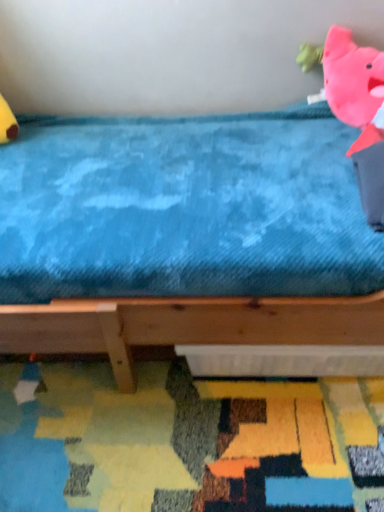
Question: Does textured multicolored mat at lower center have a lesser width compared to pink plush toy at upper right?

Choices:
 (A) no
 (B) yes

Answer: (A)

Question: Considering the relative sizes of textured multicolored mat at lower center and pink plush toy at upper right in the image provided, is textured multicolored mat at lower center bigger than pink plush toy at upper right?

Choices:
 (A) no
 (B) yes

Answer: (B)

Question: Does textured multicolored mat at lower center appear on the left side of pink plush toy at upper right?

Choices:
 (A) yes
 (B) no

Answer: (A)

Question: Can we say textured multicolored mat at lower center lies outside pink plush toy at upper right?

Choices:
 (A) no
 (B) yes

Answer: (B)

Question: Is textured multicolored mat at lower center positioned before pink plush toy at upper right?

Choices:
 (A) no
 (B) yes

Answer: (B)

Question: Considering the relative positions of textured multicolored mat at lower center and pink plush toy at upper right in the image provided, is textured multicolored mat at lower center behind pink plush toy at upper right?

Choices:
 (A) yes
 (B) no

Answer: (B)

Question: From a real-world perspective, is blue plush bed at upper center below textured multicolored mat at lower center?

Choices:
 (A) yes
 (B) no

Answer: (B)

Question: Considering the relative sizes of blue plush bed at upper center and textured multicolored mat at lower center in the image provided, is blue plush bed at upper center taller than textured multicolored mat at lower center?

Choices:
 (A) yes
 (B) no

Answer: (A)

Question: Is the depth of blue plush bed at upper center greater than that of textured multicolored mat at lower center?

Choices:
 (A) no
 (B) yes

Answer: (A)

Question: Considering the relative sizes of blue plush bed at upper center and textured multicolored mat at lower center in the image provided, is blue plush bed at upper center shorter than textured multicolored mat at lower center?

Choices:
 (A) no
 (B) yes

Answer: (A)

Question: Is blue plush bed at upper center positioned beyond the bounds of textured multicolored mat at lower center?

Choices:
 (A) no
 (B) yes

Answer: (B)

Question: Does blue plush bed at upper center have a smaller size compared to textured multicolored mat at lower center?

Choices:
 (A) yes
 (B) no

Answer: (B)

Question: Can you confirm if pink plush toy at upper right is taller than textured multicolored mat at lower center?

Choices:
 (A) yes
 (B) no

Answer: (A)